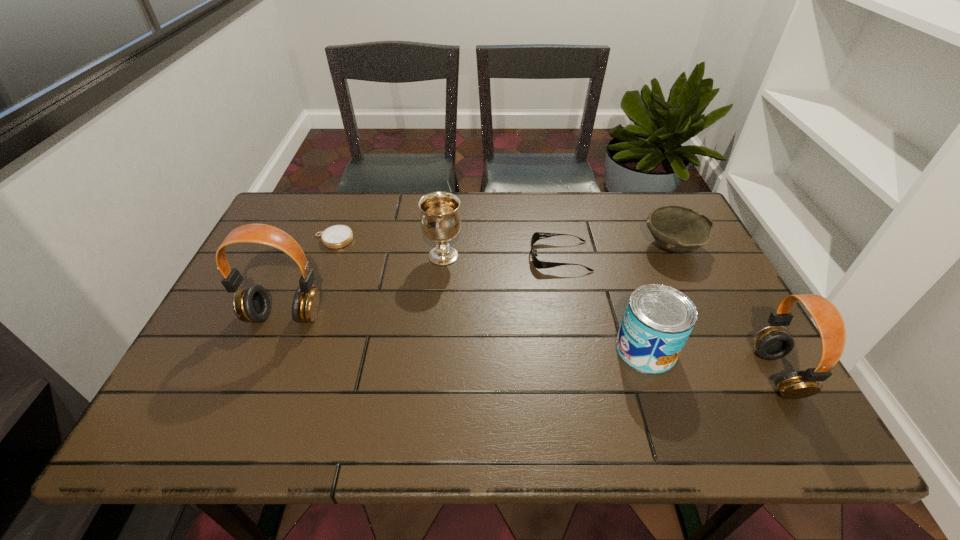
Find the location of a particular element. vacant area that lies between the bowl and the sixth tallest object is located at coordinates (616, 251).

Find the location of a particular element. The width and height of the screenshot is (960, 540). vacant space in between the fourth object from left to right and the fifth tallest object is located at coordinates (616, 251).

Where is `object that ranks as the second closest to the shortest object`? This screenshot has height=540, width=960. object that ranks as the second closest to the shortest object is located at coordinates coord(440,219).

Identify which object is the fifth closest to the shortest object. Please provide its 2D coordinates. Your answer should be formatted as a tuple, i.e. [(x, y)], where the tuple contains the x and y coordinates of a point satisfying the conditions above.

[(679, 229)]

Identify the location of vacant point that satisfies the following two spatial constraints: 1. on the front side of the third object from left to right; 2. on the left side of the fifth object from left to right. Image resolution: width=960 pixels, height=540 pixels. (435, 349).